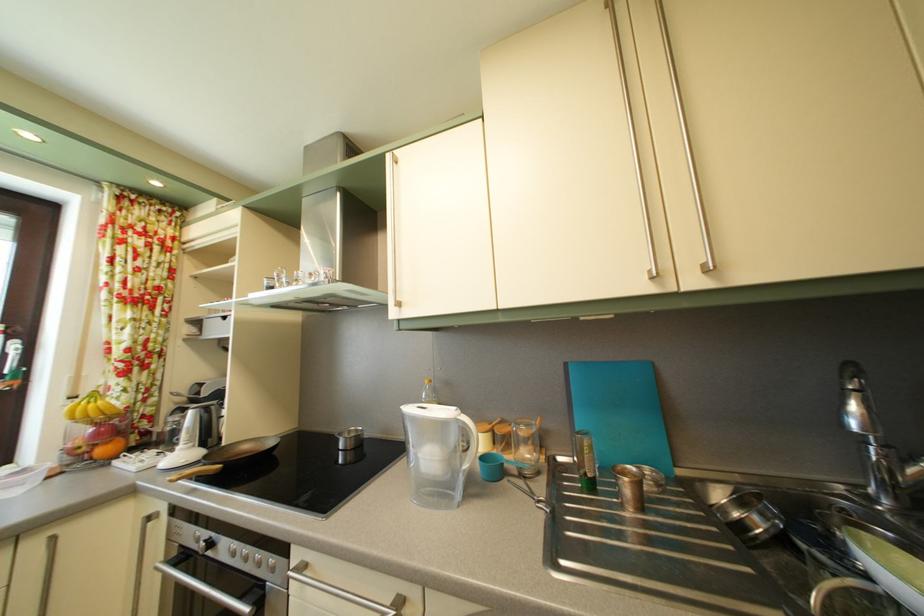
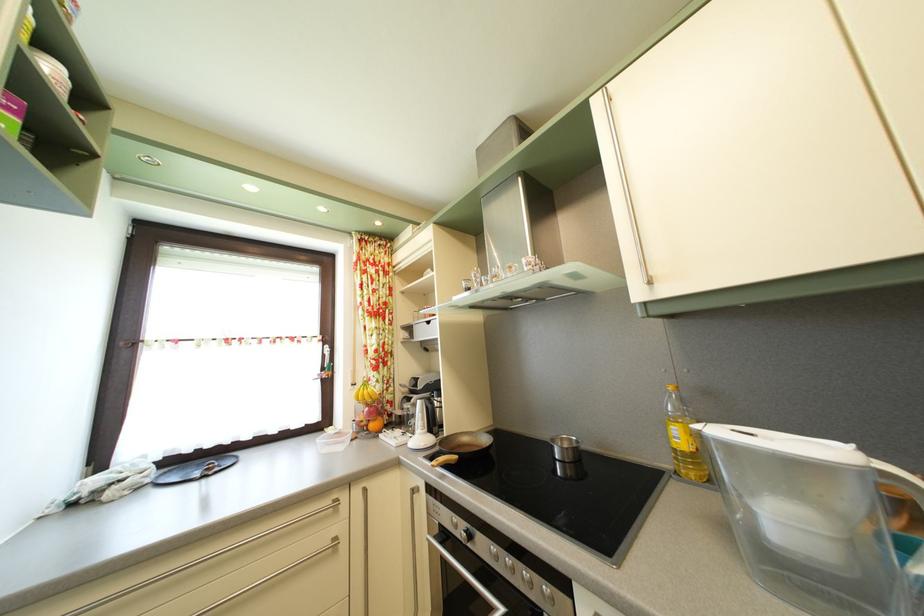
Find the pixel in the second image that matches (x=434, y=389) in the first image.

(678, 395)